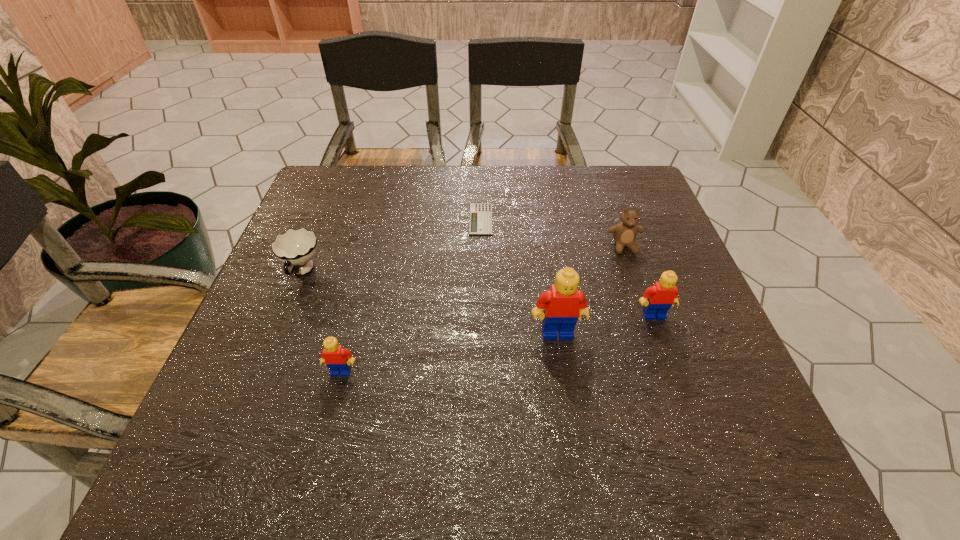
The width and height of the screenshot is (960, 540). Find the location of `teddy bear at the right edge`. teddy bear at the right edge is located at coordinates (624, 233).

You are a GUI agent. You are given a task and a screenshot of the screen. Output one action in this format:
    pyautogui.click(x=<x>, y=<y>)
    Task: Click on the blank space at the far edge of the desktop
    The height and width of the screenshot is (540, 960).
    Given the screenshot: What is the action you would take?
    pyautogui.click(x=423, y=184)

This screenshot has width=960, height=540. I want to click on vacant space at the near edge of the desktop, so click(356, 381).

Image resolution: width=960 pixels, height=540 pixels. I want to click on free region at the left edge of the desktop, so click(321, 231).

Identify the location of blank space at the right edge of the desktop. (715, 355).

Find the location of a particular element. The image size is (960, 540). vacant space at the far left corner of the desktop is located at coordinates (338, 194).

This screenshot has width=960, height=540. In order to click on vacant space at the far right corner in this screenshot , I will do `click(608, 212)`.

The image size is (960, 540). In the image, there is a desktop. In order to click on vacant area at the near right corner in this screenshot , I will do [671, 383].

I want to click on free space between the nearest object and the fifth tallest object, so [x=322, y=322].

Where is `free area in between the third object from left to right and the teddy bear`? This screenshot has height=540, width=960. free area in between the third object from left to right and the teddy bear is located at coordinates (552, 233).